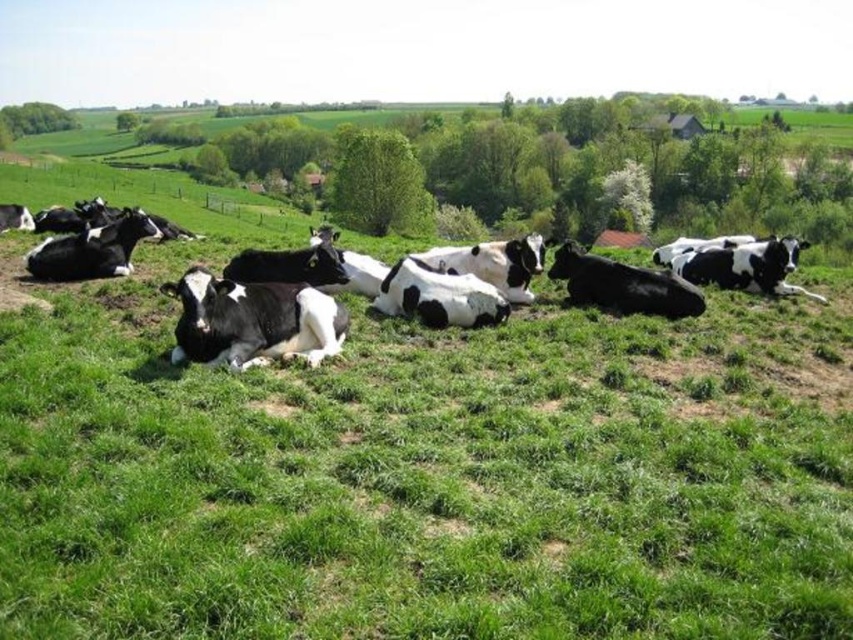
Who is positioned more to the left, black and white fur at center or black smooth cow at center?

black and white fur at center

Does black and white fur at center have a lesser width compared to black smooth cow at center?

Indeed, black and white fur at center has a lesser width compared to black smooth cow at center.

Describe the element at coordinates (252, 321) in the screenshot. The image size is (853, 640). I see `black and white fur at center` at that location.

You are a GUI agent. You are given a task and a screenshot of the screen. Output one action in this format:
    pyautogui.click(x=<x>, y=<y>)
    Task: Click on the black and white fur at center
    This screenshot has height=640, width=853.
    Given the screenshot: What is the action you would take?
    pyautogui.click(x=252, y=321)

Which is more to the left, black and white fur at center or black and white cow at center?

black and white cow at center

You are a GUI agent. You are given a task and a screenshot of the screen. Output one action in this format:
    pyautogui.click(x=<x>, y=<y>)
    Task: Click on the black and white fur at center
    
    Given the screenshot: What is the action you would take?
    pyautogui.click(x=252, y=321)

Can you confirm if black and white cow at center is thinner than black smooth cow at center?

No.

At what (x,y) coordinates should I click in order to perform the action: click on black and white cow at center. Please return your answer as a coordinate pair (x, y). The image size is (853, 640). Looking at the image, I should click on (93, 248).

You are a GUI agent. You are given a task and a screenshot of the screen. Output one action in this format:
    pyautogui.click(x=<x>, y=<y>)
    Task: Click on the black and white cow at center
    This screenshot has height=640, width=853.
    Given the screenshot: What is the action you would take?
    pyautogui.click(x=93, y=248)

The width and height of the screenshot is (853, 640). Find the location of `black and white cow at center`. black and white cow at center is located at coordinates 93,248.